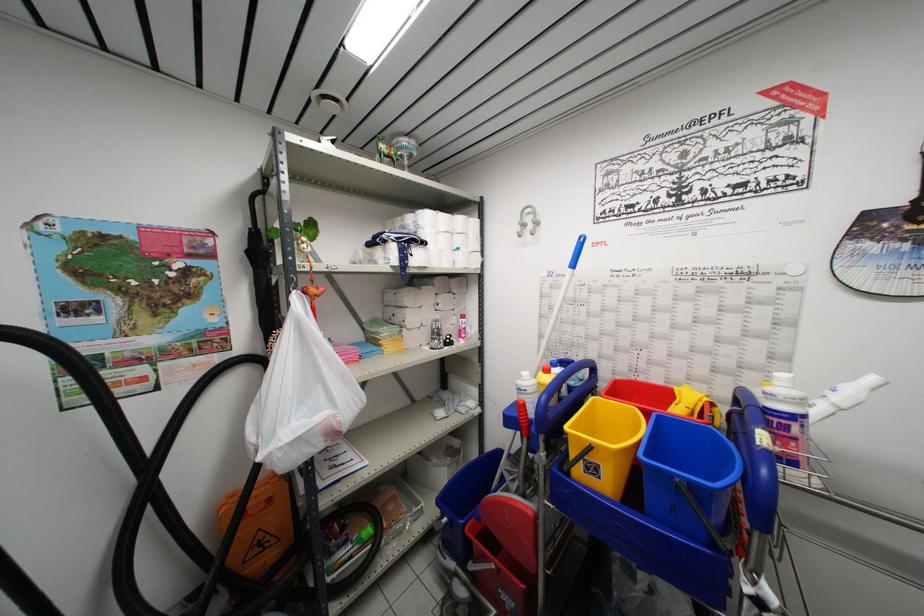
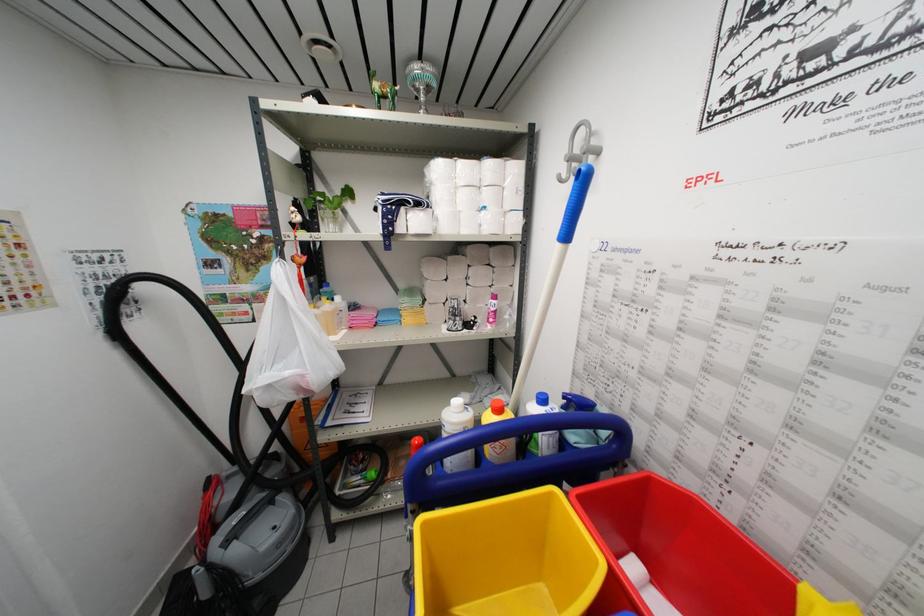
Find the pixel in the second image that matches pixel 462 246 in the first image.

(490, 201)